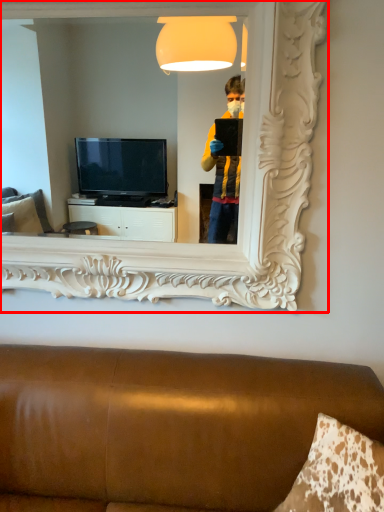
Question: In this image, where is mirror (annotated by the red box) located relative to furniture?

Choices:
 (A) left
 (B) right

Answer: (A)